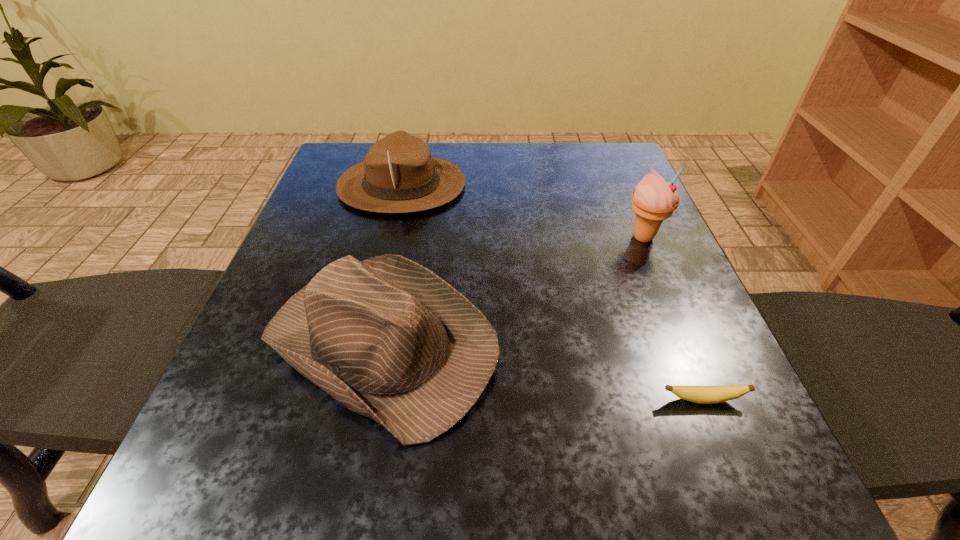
Locate which object is the third closest to the nearer fedora. Please provide its 2D coordinates. Your answer should be formatted as a tuple, i.e. [(x, y)], where the tuple contains the x and y coordinates of a point satisfying the conditions above.

[(654, 200)]

Where is `free space that satisfies the following two spatial constraints: 1. on the feather side of the farther fedora; 2. on the right side of the nearer fedora`? The width and height of the screenshot is (960, 540). free space that satisfies the following two spatial constraints: 1. on the feather side of the farther fedora; 2. on the right side of the nearer fedora is located at coordinates (365, 343).

Find the location of a particular element. The height and width of the screenshot is (540, 960). free space in the image that satisfies the following two spatial constraints: 1. on the feather side of the farthest object; 2. on the right side of the second farthest object is located at coordinates (390, 237).

You are a GUI agent. You are given a task and a screenshot of the screen. Output one action in this format:
    pyautogui.click(x=<x>, y=<y>)
    Task: Click on the vacant area in the image that satisfies the following two spatial constraints: 1. on the back side of the nearer fedora; 2. on the feather side of the farthest object
    This screenshot has width=960, height=540.
    Given the screenshot: What is the action you would take?
    pyautogui.click(x=414, y=185)

Identify the location of vacant space that satisfies the following two spatial constraints: 1. on the back side of the icecream; 2. on the left side of the nearer fedora. The height and width of the screenshot is (540, 960). (403, 237).

Where is `free space that satisfies the following two spatial constraints: 1. on the back side of the banana; 2. on the feather side of the farthest object`? The height and width of the screenshot is (540, 960). free space that satisfies the following two spatial constraints: 1. on the back side of the banana; 2. on the feather side of the farthest object is located at coordinates (616, 185).

Where is `free space in the image that satisfies the following two spatial constraints: 1. on the back side of the nearer fedora; 2. on the feather side of the farthest object`? free space in the image that satisfies the following two spatial constraints: 1. on the back side of the nearer fedora; 2. on the feather side of the farthest object is located at coordinates (414, 185).

In order to click on vacant area that satisfies the following two spatial constraints: 1. on the feather side of the icecream; 2. on the left side of the farthest object in this screenshot , I will do `click(390, 237)`.

Where is `free space that satisfies the following two spatial constraints: 1. on the feather side of the farther fedora; 2. on the left side of the icecream`? This screenshot has height=540, width=960. free space that satisfies the following two spatial constraints: 1. on the feather side of the farther fedora; 2. on the left side of the icecream is located at coordinates (390, 237).

Identify the location of vacant space that satisfies the following two spatial constraints: 1. on the feather side of the second farthest object; 2. on the left side of the farther fedora. Image resolution: width=960 pixels, height=540 pixels. click(x=390, y=237).